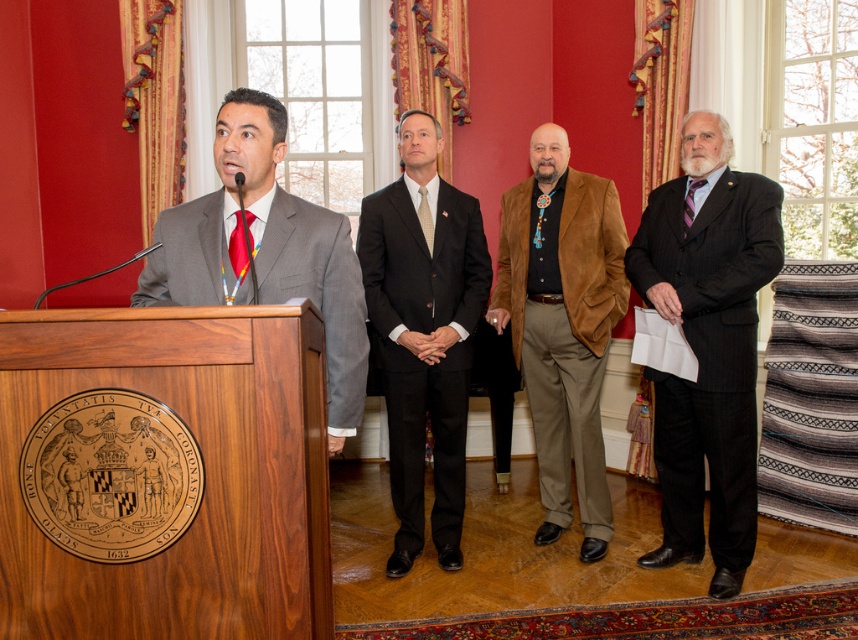
Question: Which object appears closest to the camera in this image?

Choices:
 (A) light brown textured tie at center
 (B) shiny red tie at left
 (C) black suit at center

Answer: (B)

Question: Based on their relative distances, which object is farther from the matte gray suit at left?

Choices:
 (A) purple silk tie at right
 (B) shiny red tie at left
 (C) dark gray pinstripe suit at right
 (D) light brown textured tie at center

Answer: (A)

Question: Can you confirm if dark gray pinstripe suit at right is thinner than light brown textured tie at center?

Choices:
 (A) yes
 (B) no

Answer: (B)

Question: Which object is positioned closest to the purple silk tie at right?

Choices:
 (A) matte gray suit at left
 (B) light brown textured tie at center

Answer: (B)

Question: Considering the relative positions of light brown textured tie at center and purple silk tie at right in the image provided, where is light brown textured tie at center located with respect to purple silk tie at right?

Choices:
 (A) below
 (B) above

Answer: (A)

Question: Is shiny red tie at left above light brown textured tie at center?

Choices:
 (A) yes
 (B) no

Answer: (B)